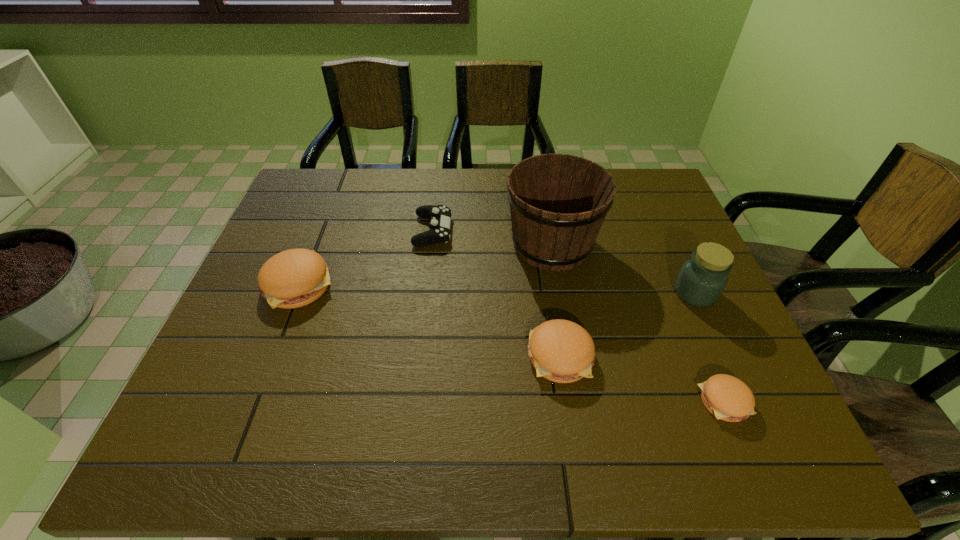
Find the location of `vacant area between the second patty from right to left and the jar`. vacant area between the second patty from right to left and the jar is located at coordinates (628, 325).

Where is `empty location between the rightmost patty and the leftmost patty`? empty location between the rightmost patty and the leftmost patty is located at coordinates (511, 343).

Identify the location of vacant area between the shortest patty and the fifth shortest object. (709, 347).

At what (x,y) coordinates should I click in order to perform the action: click on empty space between the tallest object and the control. Please return your answer as a coordinate pair (x, y). The width and height of the screenshot is (960, 540). Looking at the image, I should click on (492, 238).

Point out which object is positioned as the second nearest to the jar. Please provide its 2D coordinates. Your answer should be formatted as a tuple, i.e. [(x, y)], where the tuple contains the x and y coordinates of a point satisfying the conditions above.

[(728, 398)]

Find the location of a particular element. object that is the closest to the farthest patty is located at coordinates click(x=439, y=225).

In order to click on patty object that ranks as the closest to the rightmost patty in this screenshot , I will do `click(561, 351)`.

Select which patty appears as the closest to the tallest object. Please provide its 2D coordinates. Your answer should be formatted as a tuple, i.e. [(x, y)], where the tuple contains the x and y coordinates of a point satisfying the conditions above.

[(561, 351)]

You are a GUI agent. You are given a task and a screenshot of the screen. Output one action in this format:
    pyautogui.click(x=<x>, y=<y>)
    Task: Click on the vacant region that satisfies the following two spatial constraints: 1. on the surface of the second object from left to right; 2. on the right side of the shortest patty
    Image resolution: width=960 pixels, height=540 pixels.
    Given the screenshot: What is the action you would take?
    pyautogui.click(x=413, y=402)

At what (x,y) coordinates should I click in order to perform the action: click on vacant area that satisfies the following two spatial constraints: 1. on the surface of the jar; 2. on the left side of the fifth tallest object. Please return your answer as a coordinate pair (x, y). The height and width of the screenshot is (540, 960). Looking at the image, I should click on (425, 293).